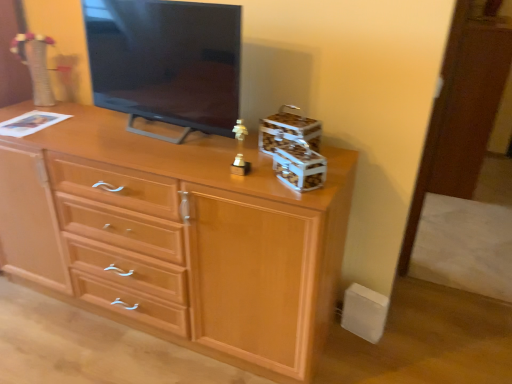
Question: Is metallic silver storage box at center-right, placed as the 1th storage box when sorted from front to back, not near light wood chest of drawers at center?

Choices:
 (A) yes
 (B) no

Answer: (B)

Question: Is metallic silver storage box at center-right, marked as the second storage box in a back-to-front arrangement, bigger than light wood chest of drawers at center?

Choices:
 (A) yes
 (B) no

Answer: (B)

Question: Is light wood chest of drawers at center located within metallic silver storage box at center-right, placed as the 1th storage box when sorted from front to back?

Choices:
 (A) yes
 (B) no

Answer: (B)

Question: Does metallic silver storage box at center-right, placed as the 1th storage box when sorted from front to back, appear on the left side of light wood chest of drawers at center?

Choices:
 (A) yes
 (B) no

Answer: (B)

Question: From a real-world perspective, is metallic silver storage box at center-right, marked as the second storage box in a back-to-front arrangement, positioned over light wood chest of drawers at center based on gravity?

Choices:
 (A) yes
 (B) no

Answer: (A)

Question: Can you confirm if metallic silver storage box at center-right, placed as the 1th storage box when sorted from front to back, is shorter than light wood chest of drawers at center?

Choices:
 (A) yes
 (B) no

Answer: (A)

Question: Considering the relative sizes of light wood chest of drawers at center and metallic silver storage box at center-right, marked as the second storage box in a back-to-front arrangement, in the image provided, is light wood chest of drawers at center smaller than metallic silver storage box at center-right, marked as the second storage box in a back-to-front arrangement,?

Choices:
 (A) no
 (B) yes

Answer: (A)

Question: From a real-world perspective, is light wood chest of drawers at center on metallic silver storage box at center-right, placed as the 1th storage box when sorted from front to back?

Choices:
 (A) no
 (B) yes

Answer: (A)

Question: Does light wood chest of drawers at center have a lesser height compared to metallic silver storage box at center-right, marked as the second storage box in a back-to-front arrangement?

Choices:
 (A) no
 (B) yes

Answer: (A)

Question: Is light wood chest of drawers at center taller than metallic silver storage box at center-right, placed as the 1th storage box when sorted from front to back?

Choices:
 (A) no
 (B) yes

Answer: (B)

Question: Is light wood chest of drawers at center located outside metallic silver storage box at center-right, placed as the 1th storage box when sorted from front to back?

Choices:
 (A) yes
 (B) no

Answer: (A)

Question: Does light wood chest of drawers at center appear on the right side of metallic silver storage box at center-right, marked as the second storage box in a back-to-front arrangement?

Choices:
 (A) yes
 (B) no

Answer: (B)

Question: Are matte black tv at center and wooden storage box at upper right, the first storage box in the back-to-front sequence, beside each other?

Choices:
 (A) no
 (B) yes

Answer: (A)